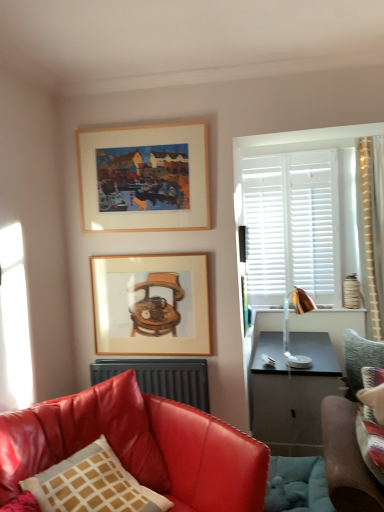
What do you see at coordinates (288, 326) in the screenshot? I see `copper metallic lamp at right` at bounding box center [288, 326].

Locate an element on the screen. This screenshot has height=512, width=384. copper metallic lamp at right is located at coordinates (288, 326).

Describe the element at coordinates (139, 446) in the screenshot. I see `shiny leather couch at lower left, placed as the first studio couch when sorted from front to back` at that location.

I want to click on wooden framed picture at center, the 2th picture frame viewed from the top, so click(151, 304).

You are a GUI agent. You are given a task and a screenshot of the screen. Output one action in this format:
    pyautogui.click(x=<x>, y=<y>)
    Task: Click on the dark gray metallic radiator at lower center
    
    Given the screenshot: What is the action you would take?
    pyautogui.click(x=161, y=378)

Considering their positions, is wooden frame at upper center, the 2th picture frame when ordered from bottom to top, located in front of or behind velvet green sofa at right, the 1th studio couch in the right-to-left sequence?

wooden frame at upper center, the 2th picture frame when ordered from bottom to top, is in front of velvet green sofa at right, the 1th studio couch in the right-to-left sequence.

Looking at this image, is the surface of wooden frame at upper center, the 2th picture frame when ordered from bottom to top, in direct contact with velvet green sofa at right, the 1th studio couch in the right-to-left sequence?

No, wooden frame at upper center, the 2th picture frame when ordered from bottom to top, is not next to velvet green sofa at right, the 1th studio couch in the right-to-left sequence.

From their relative heights in the image, would you say wooden frame at upper center, the 2th picture frame when ordered from bottom to top, is taller or shorter than velvet green sofa at right, positioned as the 2th studio couch in left-to-right order?

Clearly, wooden frame at upper center, the 2th picture frame when ordered from bottom to top, is shorter compared to velvet green sofa at right, positioned as the 2th studio couch in left-to-right order.

Between point (286, 297) and point (191, 286), which one is positioned in front?

The point (191, 286) is in front.

Is copper metallic lamp at right turned away from wooden framed picture at center, acting as the 1th picture frame starting from the bottom?

No.

Considering the relative sizes of copper metallic lamp at right and wooden framed picture at center, acting as the 1th picture frame starting from the bottom, in the image provided, is copper metallic lamp at right bigger than wooden framed picture at center, acting as the 1th picture frame starting from the bottom,?

Indeed, copper metallic lamp at right has a larger size compared to wooden framed picture at center, acting as the 1th picture frame starting from the bottom.

In terms of height, does copper metallic lamp at right look taller or shorter compared to wooden framed picture at center, acting as the 1th picture frame starting from the bottom?

In the image, copper metallic lamp at right appears to be shorter than wooden framed picture at center, acting as the 1th picture frame starting from the bottom.

Considering the relative positions of velvet green sofa at right, which ranks as the second studio couch in front-to-back order, and shiny leather couch at lower left, the 2th studio couch from the back, in the image provided, is velvet green sofa at right, which ranks as the second studio couch in front-to-back order, to the right of shiny leather couch at lower left, the 2th studio couch from the back, from the viewer's perspective?

Yes.

Consider the image. From the image's perspective, is velvet green sofa at right, positioned as the 2th studio couch in left-to-right order, positioned above or below shiny leather couch at lower left, the 1th studio couch when ordered from left to right?

From the image's perspective, velvet green sofa at right, positioned as the 2th studio couch in left-to-right order, appears above shiny leather couch at lower left, the 1th studio couch when ordered from left to right.

Does point (345, 469) lie behind point (218, 435)?

No, (345, 469) is in front of (218, 435).

How different are the orientations of velvet green sofa at right, the first studio couch from the back, and shiny leather couch at lower left, the 1th studio couch when ordered from left to right, in degrees?

They differ by 52.6 degrees in their facing directions.

Which of these two, shiny leather couch at lower left, placed as the first studio couch when sorted from front to back, or matte white pillow with brown grid at lower left, is bigger?

shiny leather couch at lower left, placed as the first studio couch when sorted from front to back.

Which is behind, shiny leather couch at lower left, the 2th studio couch from the back, or matte white pillow with brown grid at lower left?

matte white pillow with brown grid at lower left is further from the camera.

In the scene shown: From the image's perspective, is shiny leather couch at lower left, which is the second studio couch from right to left, located beneath matte white pillow with brown grid at lower left?

Yes, from the image's perspective, shiny leather couch at lower left, which is the second studio couch from right to left, is below matte white pillow with brown grid at lower left.

Considering the sizes of objects shiny leather couch at lower left, the 1th studio couch when ordered from left to right, and matte white pillow with brown grid at lower left in the image provided, who is thinner, shiny leather couch at lower left, the 1th studio couch when ordered from left to right, or matte white pillow with brown grid at lower left?

Thinner between the two is matte white pillow with brown grid at lower left.

Which of these two, wooden framed picture at center, the 2th picture frame viewed from the top, or matte white pillow with brown grid at lower left, stands taller?

With more height is wooden framed picture at center, the 2th picture frame viewed from the top.

Is wooden framed picture at center, the 2th picture frame viewed from the top, looking in the opposite direction of matte white pillow with brown grid at lower left?

wooden framed picture at center, the 2th picture frame viewed from the top, is not turned away from matte white pillow with brown grid at lower left.

Based on the photo, measure the distance from wooden framed picture at center, acting as the 1th picture frame starting from the bottom, to matte white pillow with brown grid at lower left.

wooden framed picture at center, acting as the 1th picture frame starting from the bottom, and matte white pillow with brown grid at lower left are 1.03 meters apart from each other.

Can you confirm if wooden framed picture at center, the 2th picture frame viewed from the top, is positioned to the right of matte white pillow with brown grid at lower left?

Correct, you'll find wooden framed picture at center, the 2th picture frame viewed from the top, to the right of matte white pillow with brown grid at lower left.

From a real-world perspective, between wooden framed picture at center, the 2th picture frame viewed from the top, and shiny leather couch at lower left, the 2th studio couch from the back, who is vertically higher?

From a 3D spatial view, wooden framed picture at center, the 2th picture frame viewed from the top, is above.

From the image's perspective, is wooden framed picture at center, acting as the 1th picture frame starting from the bottom, located above or below shiny leather couch at lower left, the 1th studio couch when ordered from left to right?

Based on their image positions, wooden framed picture at center, acting as the 1th picture frame starting from the bottom, is located above shiny leather couch at lower left, the 1th studio couch when ordered from left to right.

Would you say matte white pillow with brown grid at lower left is a long distance from dark gray metallic radiator at lower center?

That's not correct — matte white pillow with brown grid at lower left is a little close to dark gray metallic radiator at lower center.

From a real-world perspective, between matte white pillow with brown grid at lower left and dark gray metallic radiator at lower center, who is vertically higher?

dark gray metallic radiator at lower center, from a real-world perspective.

From the picture: Considering the sizes of objects matte white pillow with brown grid at lower left and dark gray metallic radiator at lower center in the image provided, who is bigger, matte white pillow with brown grid at lower left or dark gray metallic radiator at lower center?

matte white pillow with brown grid at lower left is bigger.

Identify the location of pillow lying on the left of dark gray metallic radiator at lower center. This screenshot has width=384, height=512. (92, 484).

This screenshot has width=384, height=512. I want to click on picture frame that is the 2nd object to the left of the velvet green sofa at right, the 1th studio couch in the right-to-left sequence, starting at the anchor, so click(x=144, y=177).

The width and height of the screenshot is (384, 512). What are the coordinates of `picture frame that is the 1st one above the copper metallic lamp at right (from a real-world perspective)` in the screenshot? It's located at (151, 304).

Looking at this image, looking at the image, which one is located closer to shiny leather couch at lower left, which is the second studio couch from right to left, wooden frame at upper center, acting as the first picture frame starting from the top, or wooden framed picture at center, the 2th picture frame viewed from the top?

wooden framed picture at center, the 2th picture frame viewed from the top, lies closer to shiny leather couch at lower left, which is the second studio couch from right to left, than the other object.

When comparing their distances from velvet green sofa at right, the 1th studio couch in the right-to-left sequence, does dark gray metallic radiator at lower center or copper metallic lamp at right seem closer?

The object closer to velvet green sofa at right, the 1th studio couch in the right-to-left sequence, is copper metallic lamp at right.

Looking at the image, which one is located closer to shiny leather couch at lower left, the 1th studio couch when ordered from left to right, wooden frame at upper center, acting as the first picture frame starting from the top, or dark gray metallic radiator at lower center?

dark gray metallic radiator at lower center is positioned closer to the anchor shiny leather couch at lower left, the 1th studio couch when ordered from left to right.

Estimate the real-world distances between objects in this image. Which object is further from dark gray metallic radiator at lower center, copper metallic lamp at right or wooden frame at upper center, the 2th picture frame when ordered from bottom to top?

wooden frame at upper center, the 2th picture frame when ordered from bottom to top, is positioned further to the anchor dark gray metallic radiator at lower center.

When comparing their distances from shiny leather couch at lower left, which is the second studio couch from right to left, does wooden framed picture at center, acting as the 1th picture frame starting from the bottom, or velvet green sofa at right, positioned as the 2th studio couch in left-to-right order, seem further?

Based on the image, velvet green sofa at right, positioned as the 2th studio couch in left-to-right order, appears to be further to shiny leather couch at lower left, which is the second studio couch from right to left.

From the image, which object appears to be nearer to copper metallic lamp at right, wooden frame at upper center, acting as the first picture frame starting from the top, or velvet green sofa at right, positioned as the 2th studio couch in left-to-right order?

Among the two, velvet green sofa at right, positioned as the 2th studio couch in left-to-right order, is located nearer to copper metallic lamp at right.

Considering their positions, is matte white pillow with brown grid at lower left positioned further to wooden framed picture at center, the 2th picture frame viewed from the top, than copper metallic lamp at right?

copper metallic lamp at right is further to wooden framed picture at center, the 2th picture frame viewed from the top.

Which object lies nearer to the anchor point copper metallic lamp at right, wooden framed picture at center, the 2th picture frame viewed from the top, or wooden frame at upper center, acting as the first picture frame starting from the top?

wooden framed picture at center, the 2th picture frame viewed from the top, is closer to copper metallic lamp at right.

Image resolution: width=384 pixels, height=512 pixels. Find the location of `radiator between shiny leather couch at lower left, placed as the first studio couch when sorted from front to back, and wooden framed picture at center, the 2th picture frame viewed from the top, in the front-back direction`. radiator between shiny leather couch at lower left, placed as the first studio couch when sorted from front to back, and wooden framed picture at center, the 2th picture frame viewed from the top, in the front-back direction is located at coordinates (161, 378).

You are a GUI agent. You are given a task and a screenshot of the screen. Output one action in this format:
    pyautogui.click(x=<x>, y=<y>)
    Task: Click on the radiator located between shiny leather couch at lower left, which is the second studio couch from right to left, and copper metallic lamp at right in the depth direction
    
    Given the screenshot: What is the action you would take?
    pyautogui.click(x=161, y=378)

Identify the location of pillow that lies between wooden frame at upper center, acting as the first picture frame starting from the top, and shiny leather couch at lower left, which is the second studio couch from right to left, from top to bottom. This screenshot has height=512, width=384. (92, 484).

Where is `pillow positioned between shiny leather couch at lower left, placed as the first studio couch when sorted from front to back, and wooden framed picture at center, acting as the 1th picture frame starting from the bottom, from near to far`? pillow positioned between shiny leather couch at lower left, placed as the first studio couch when sorted from front to back, and wooden framed picture at center, acting as the 1th picture frame starting from the bottom, from near to far is located at coordinates (92, 484).